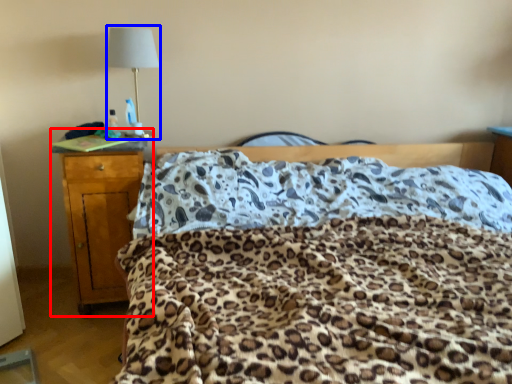
Question: Among these objects, which one is farthest to the camera, nightstand (highlighted by a red box) or lamp (highlighted by a blue box)?

Choices:
 (A) nightstand
 (B) lamp

Answer: (B)